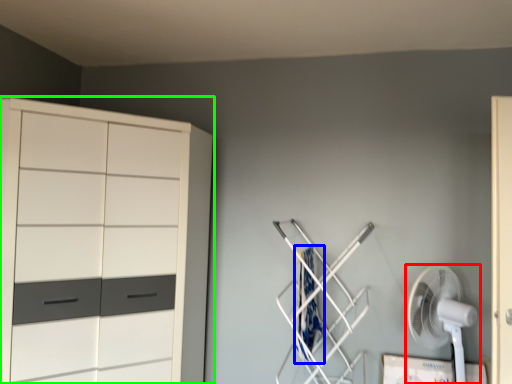
Question: Which object is positioned farthest from mechanical fan (highlighted by a red box)? Select from laundry (highlighted by a blue box) and cupboard (highlighted by a green box).

Choices:
 (A) laundry
 (B) cupboard

Answer: (B)